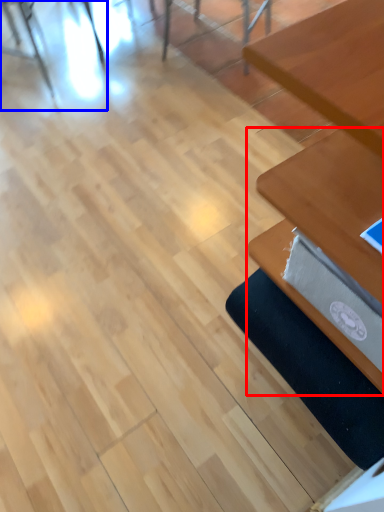
Question: Which object is closer to the camera taking this photo, table (highlighted by a red box) or chair (highlighted by a blue box)?

Choices:
 (A) table
 (B) chair

Answer: (A)